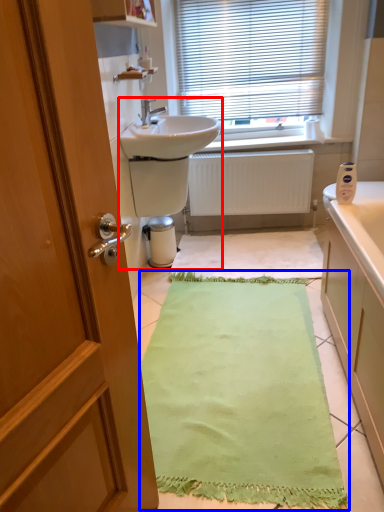
Question: Which of the following is the closest to the observer, sink (highlighted by a red box) or bath mat (highlighted by a blue box)?

Choices:
 (A) sink
 (B) bath mat

Answer: (B)